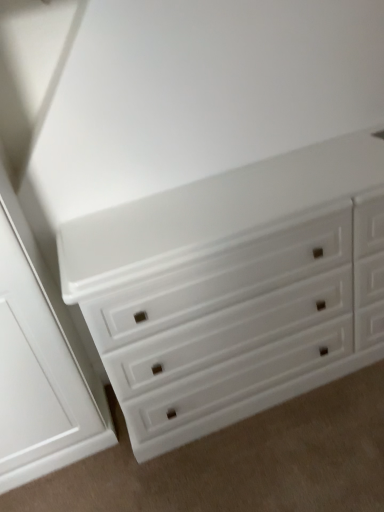
The width and height of the screenshot is (384, 512). Identify the location of vacant point above white painted wood chest of drawers at center (from a real-world perspective). (183, 209).